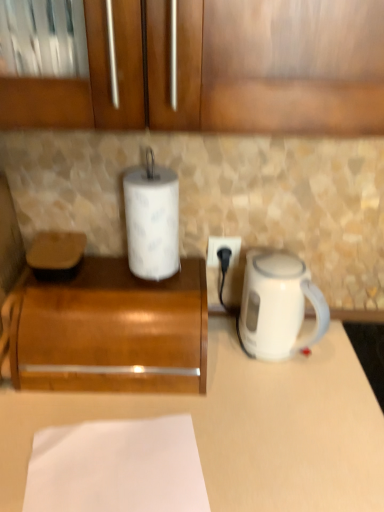
I want to click on free space behind white paper at lower center, so click(144, 396).